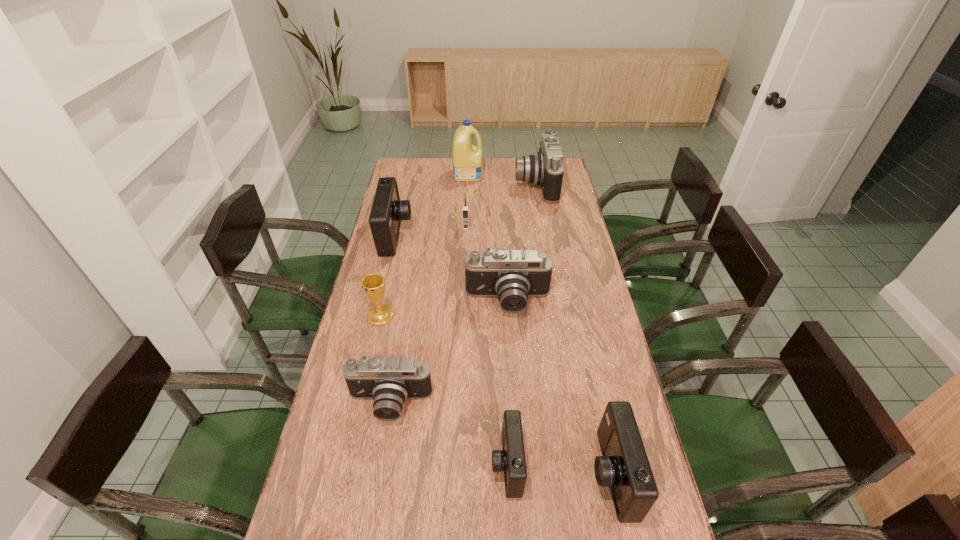
You are a GUI agent. You are given a task and a screenshot of the screen. Output one action in this format:
    pyautogui.click(x=<x>, y=<y>)
    Task: Click on the camera present at the far edge
    The height and width of the screenshot is (540, 960).
    Given the screenshot: What is the action you would take?
    pyautogui.click(x=545, y=168)

I want to click on chalice located in the left edge section of the desktop, so click(373, 285).

At what (x,y) coordinates should I click in order to perform the action: click on object that is at the far right corner. Please return your answer as a coordinate pair (x, y). This screenshot has width=960, height=540. Looking at the image, I should click on point(545,168).

This screenshot has height=540, width=960. What are the coordinates of `vacant space at the left edge` in the screenshot? It's located at (314, 485).

Find the location of a particular element. This screenshot has width=960, height=540. vacant space at the right edge is located at coordinates (592, 325).

The width and height of the screenshot is (960, 540). In order to click on vacant region between the chalice and the fourth nearest camera in this screenshot , I will do pos(444,309).

Identify the location of unoccupied position between the shortest camera and the leftmost black camera. The height and width of the screenshot is (540, 960). (448, 434).

Identify the location of vacant space that's between the leftmost black camera and the tallest object. The width and height of the screenshot is (960, 540). (429, 289).

Locate an element on the screen. Image resolution: width=960 pixels, height=540 pixels. vacant space in between the smallest blue camera and the farthest black camera is located at coordinates (521, 324).

Where is `free space between the rightmost blue camera and the biggest black camera`? free space between the rightmost blue camera and the biggest black camera is located at coordinates (573, 329).